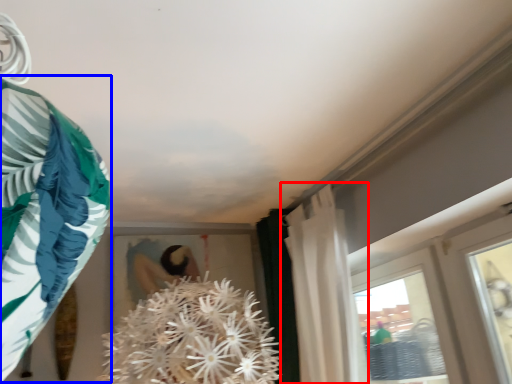
Question: Which of the following is the farthest to the observer, curtain (highlighted by a red box) or clothing (highlighted by a blue box)?

Choices:
 (A) curtain
 (B) clothing

Answer: (A)